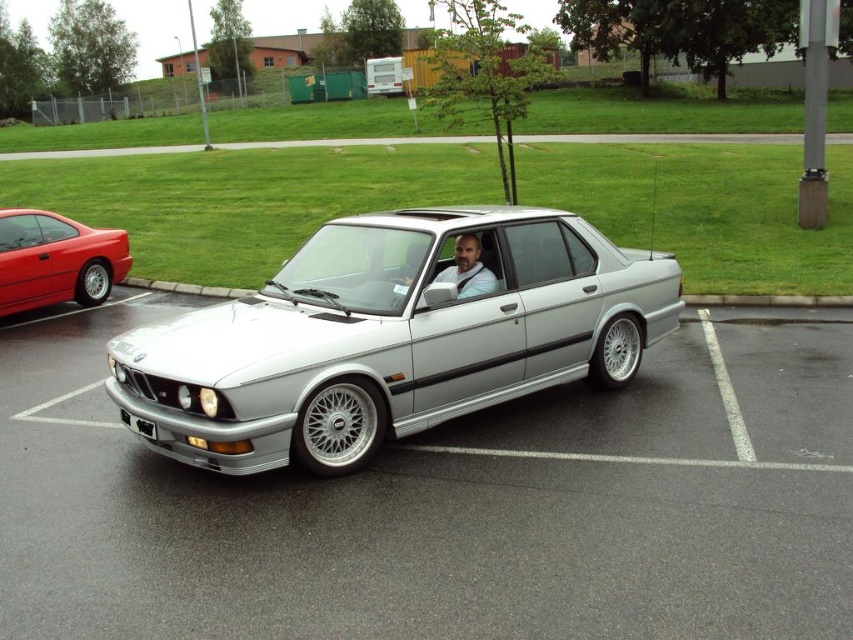
You are a delivery person trying to deliver a package to the bearded man in shirt at center. The silver metallic car at center is blocking the path. Can you walk around the car to reach him?

The silver metallic car at center is positioned under bearded man in shirt at center, which means the car is below him. Since the car is parked and the man is inside, you can approach the driver side door which is open to deliver the package without needing to go around the car.

You are a delivery person trying to deliver a package to the driver of the silver BMW sedan. The driver is currently sitting in the car with the door open. To hand over the package, you need to reach the driver through the open door. Considering the height of the bearded man in shirt at center and the black plastic license plate at front, can you estimate if you can comfortably hand the package without bending too much?

The bearded man in shirt at center is much taller than the black plastic license plate at front. Since the license plate is typically mounted at a standard height on the car, the driver is likely seated higher up, so you may need to bend slightly to hand over the package comfortably.